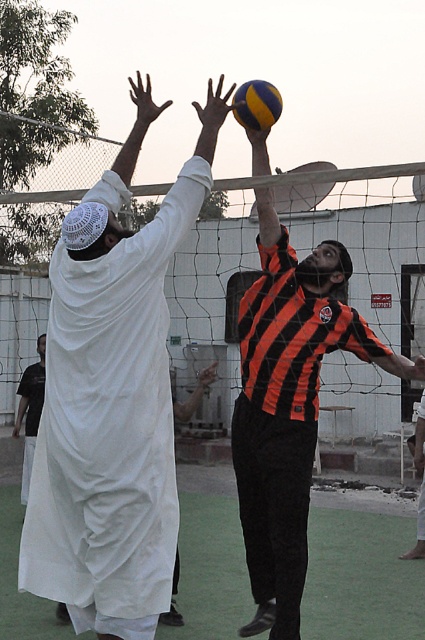
Who is positioned more to the left, orange striped shirt at upper center or yellowmaterial/texturevolleyball at upper center?

yellowmaterial/texturevolleyball at upper center is more to the left.

Who is more distant from viewer, (390, 362) or (269, 83)?

The point (269, 83) is behind.

Locate an element on the screen. This screenshot has height=640, width=425. orange striped shirt at upper center is located at coordinates (289, 406).

Between white clothed person at upper left and yellowmaterial/texturevolleyball at upper center, which one is positioned higher?

yellowmaterial/texturevolleyball at upper center is higher up.

Measure the distance between point (142, 88) and camera.

Point (142, 88) is 6.27 meters away from camera.

Which is behind, point (121, 483) or point (235, 108)?

The point (235, 108) is more distant.

You are a GUI agent. You are given a task and a screenshot of the screen. Output one action in this format:
    pyautogui.click(x=<x>, y=<y>)
    Task: Click on the white clothed person at upper left
    
    Given the screenshot: What is the action you would take?
    pyautogui.click(x=113, y=400)

Does white clothed person at upper left have a larger size compared to white cloth at upper left?

Yes, white clothed person at upper left is bigger than white cloth at upper left.

This screenshot has height=640, width=425. What do you see at coordinates (113, 400) in the screenshot? I see `white clothed person at upper left` at bounding box center [113, 400].

Image resolution: width=425 pixels, height=640 pixels. Identify the location of white clothed person at upper left. (113, 400).